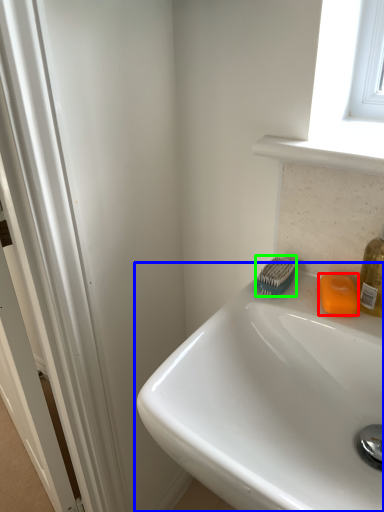
Question: Which object is the farthest from soap (highlighted by a red box)? Choose among these: sink (highlighted by a blue box) or brush (highlighted by a green box).

Choices:
 (A) sink
 (B) brush

Answer: (A)